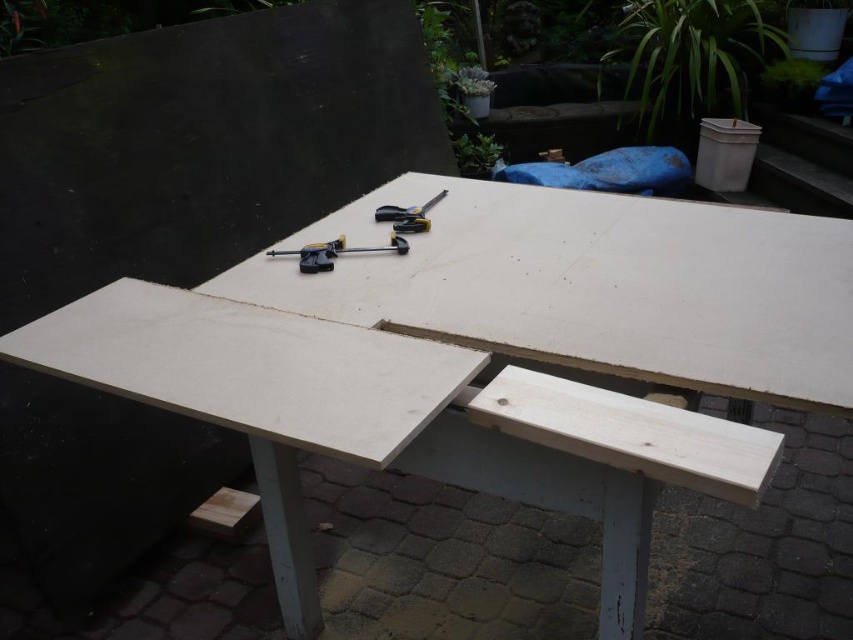
Who is higher up, natural wood picnic table at center or black plastic tool at center?

black plastic tool at center is higher up.

Is natural wood picnic table at center to the left of black plastic tool at center from the viewer's perspective?

Incorrect, natural wood picnic table at center is not on the left side of black plastic tool at center.

Between point (640, 486) and point (271, 252), which one is positioned behind?

Positioned behind is point (271, 252).

The height and width of the screenshot is (640, 853). What are the coordinates of `natural wood picnic table at center` in the screenshot? It's located at (473, 346).

I want to click on black plastic tool at center, so tap(335, 252).

Locate an element on the screen. The image size is (853, 640). black plastic tool at center is located at coordinates (335, 252).

Who is positioned more to the left, natural wood picnic table at center or metallic silver pliers at center?

Positioned to the left is metallic silver pliers at center.

In the scene shown: Does natural wood picnic table at center come behind metallic silver pliers at center?

No, it is in front of metallic silver pliers at center.

Find the location of a particular element. This screenshot has height=640, width=853. natural wood picnic table at center is located at coordinates [473, 346].